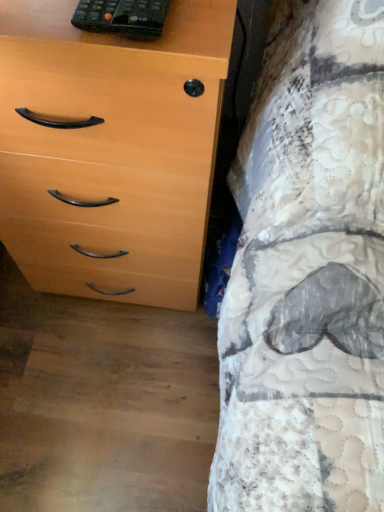
Question: Does light wood/veneer chest of drawers at left have a greater width compared to black plastic remote at upper left?

Choices:
 (A) no
 (B) yes

Answer: (B)

Question: Is light wood/veneer chest of drawers at left positioned before black plastic remote at upper left?

Choices:
 (A) no
 (B) yes

Answer: (B)

Question: Considering the relative sizes of light wood/veneer chest of drawers at left and black plastic remote at upper left in the image provided, is light wood/veneer chest of drawers at left smaller than black plastic remote at upper left?

Choices:
 (A) yes
 (B) no

Answer: (B)

Question: Is light wood/veneer chest of drawers at left to the right of black plastic remote at upper left from the viewer's perspective?

Choices:
 (A) yes
 (B) no

Answer: (B)

Question: Is light wood/veneer chest of drawers at left far from black plastic remote at upper left?

Choices:
 (A) no
 (B) yes

Answer: (A)

Question: From the image's perspective, is light wood/veneer chest of drawers at left over black plastic remote at upper left?

Choices:
 (A) yes
 (B) no

Answer: (B)

Question: Does black plastic remote at upper left appear on the right side of light wood/veneer chest of drawers at left?

Choices:
 (A) yes
 (B) no

Answer: (A)

Question: Can you see black plastic remote at upper left touching light wood/veneer chest of drawers at left?

Choices:
 (A) yes
 (B) no

Answer: (B)

Question: Does black plastic remote at upper left appear on the left side of light wood/veneer chest of drawers at left?

Choices:
 (A) no
 (B) yes

Answer: (A)

Question: Does black plastic remote at upper left have a greater height compared to light wood/veneer chest of drawers at left?

Choices:
 (A) no
 (B) yes

Answer: (A)

Question: Is black plastic remote at upper left oriented away from light wood/veneer chest of drawers at left?

Choices:
 (A) yes
 (B) no

Answer: (B)

Question: Considering the relative positions of black plastic remote at upper left and light wood/veneer chest of drawers at left in the image provided, is black plastic remote at upper left behind light wood/veneer chest of drawers at left?

Choices:
 (A) no
 (B) yes

Answer: (B)

Question: Considering the positions of black plastic remote at upper left and light wood/veneer chest of drawers at left in the image, is black plastic remote at upper left taller or shorter than light wood/veneer chest of drawers at left?

Choices:
 (A) tall
 (B) short

Answer: (B)